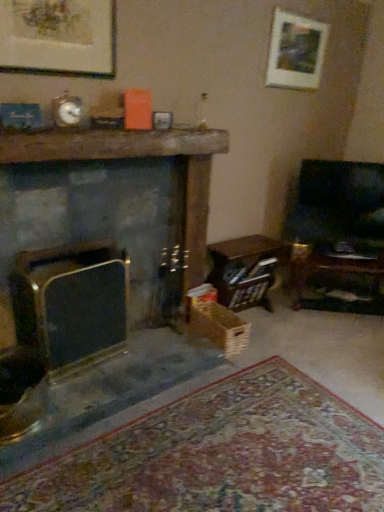
Image resolution: width=384 pixels, height=512 pixels. I want to click on vacant area situated below matte black fireplace at left, which is the first fireplace from left to right (from a real-world perspective), so click(x=94, y=362).